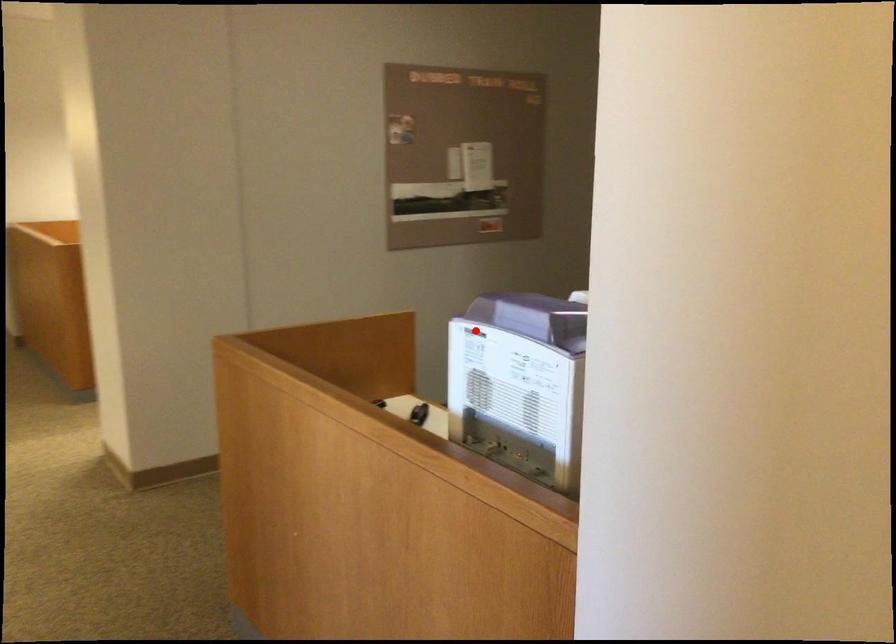
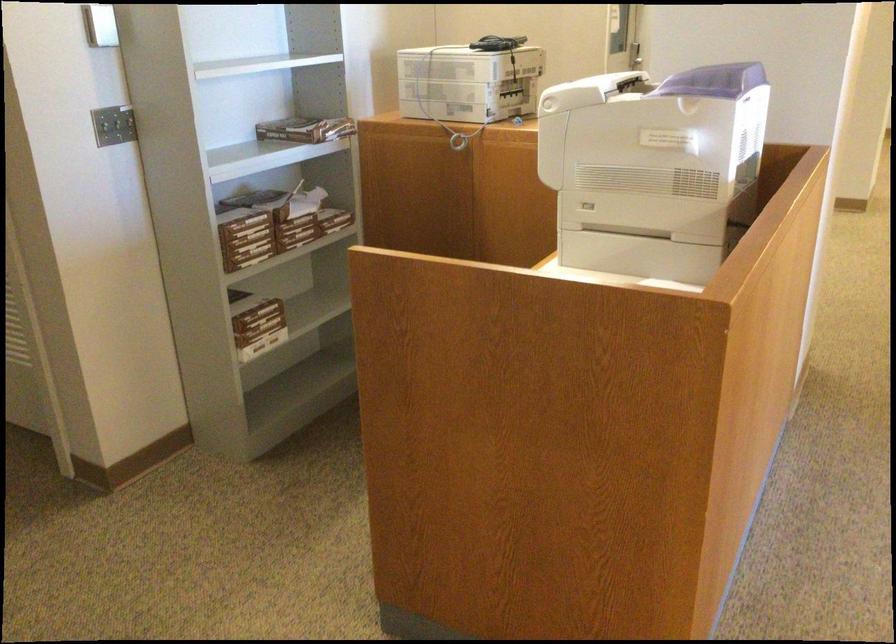
Question: I am providing you with two images of the same scene from different viewpoints. A red point is marked on the first image. Can you still see the location of the red point in image 2?

Choices:
 (A) Yes
 (B) No

Answer: (A)